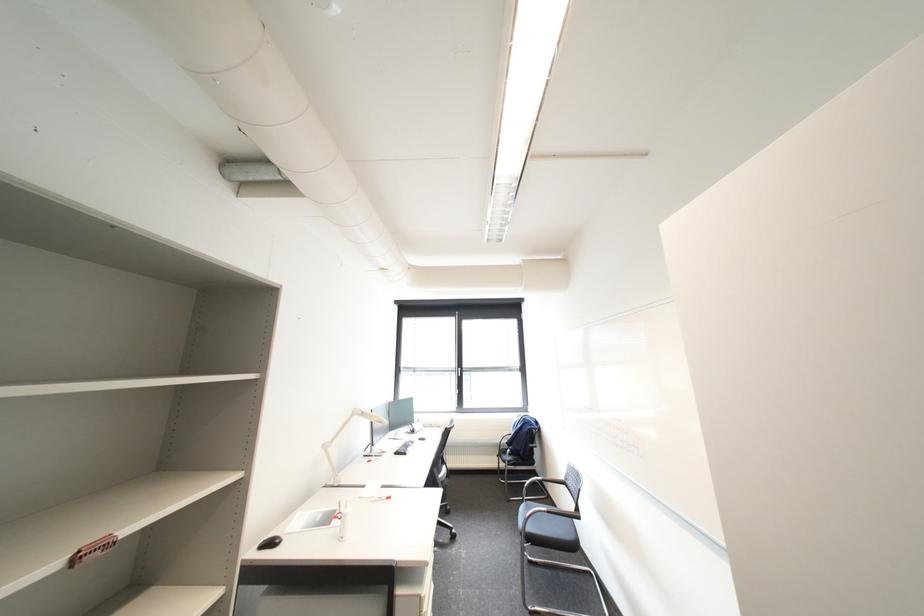
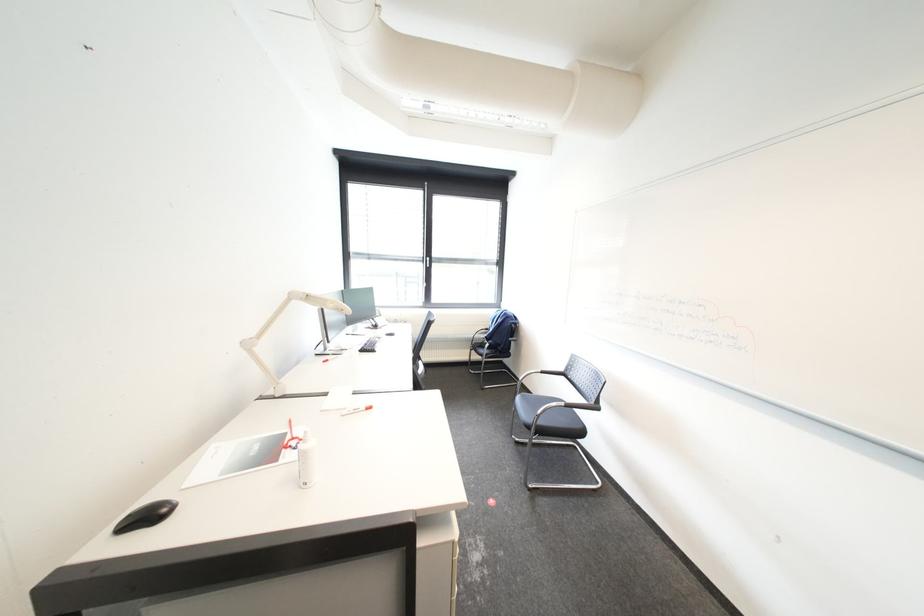
Looking at this image, the images are taken continuously from a first-person perspective. In which direction are you moving?

The movement direction of the cameraman is left, forward.